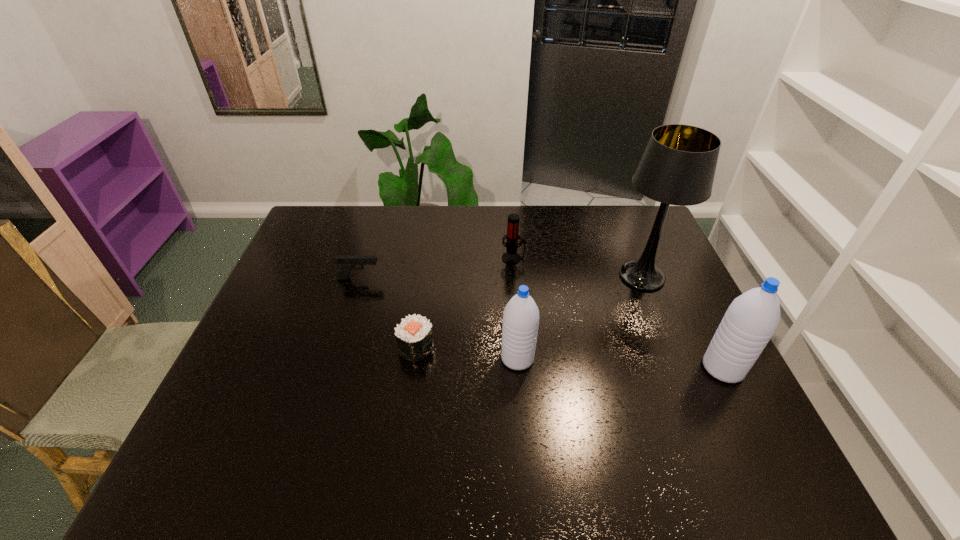
You are a GUI agent. You are given a task and a screenshot of the screen. Output one action in this format:
    pyautogui.click(x=<x>, y=<y>)
    Task: Click on the free space that satisfies the following two spatial constraints: 1. on the front-facing side of the leftmost object; 2. on the left side of the fifth shortest object
    
    Given the screenshot: What is the action you would take?
    pyautogui.click(x=332, y=368)